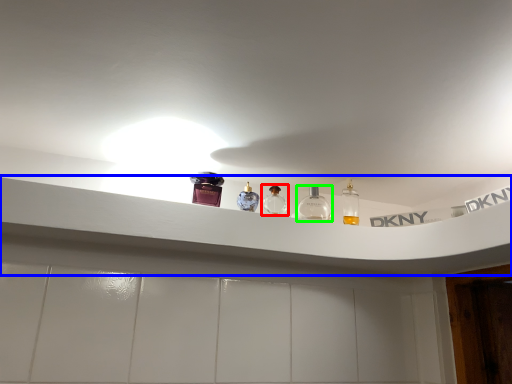
Question: Estimate the real-world distances between objects in this image. Which object is closer to bottle (highlighted by a red box), window sill (highlighted by a blue box) or bottle (highlighted by a green box)?

Choices:
 (A) window sill
 (B) bottle

Answer: (B)